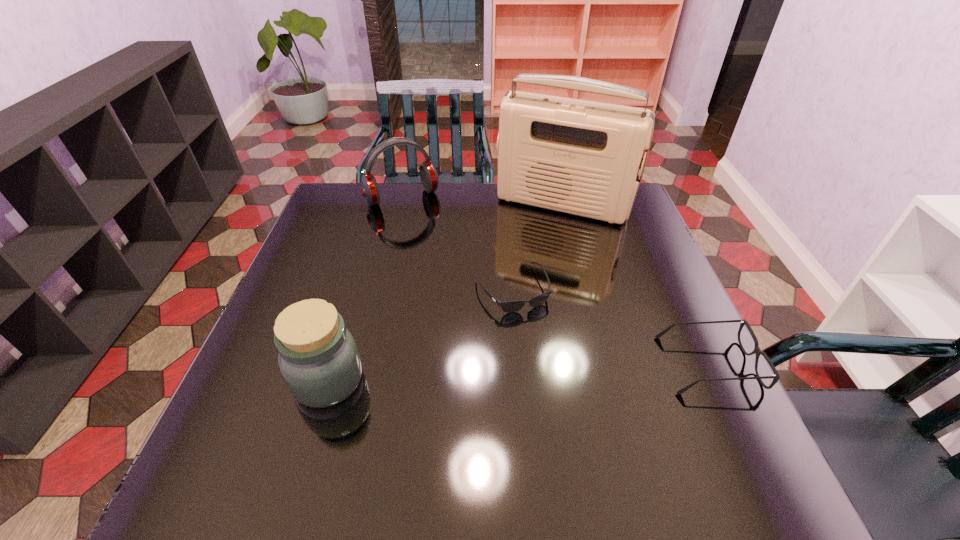
Locate an element on the screen. This screenshot has width=960, height=540. vacant region that satisfies the following two spatial constraints: 1. on the back side of the jar; 2. with the lenses facing outward on the fourth tallest object is located at coordinates (333, 364).